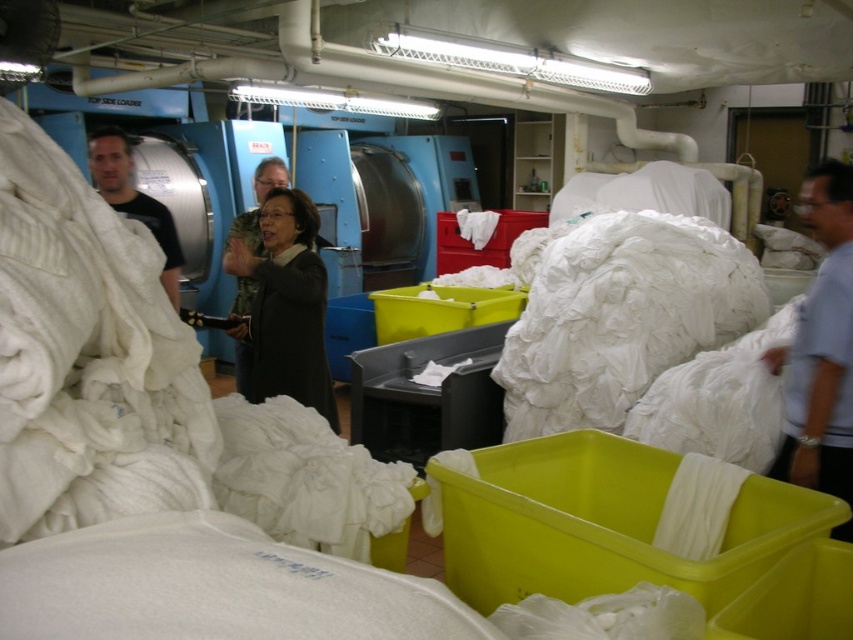
You are an employee at the laundry facility and need to place both the light blue shirt at right and the black matte shirt at left into a storage bin. Which shirt should you place first to ensure they both fit vertically?

You should place the light blue shirt at right first because it is taller than the black matte shirt at left, allowing both to fit vertically in the storage bin.

You are an employee in the laundry facility and need to retrieve the light blue shirt at right and dark gray sweater at center. Which item is closer to the floor?

The light blue shirt at right is below the dark gray sweater at center, so it is closer to the floor.